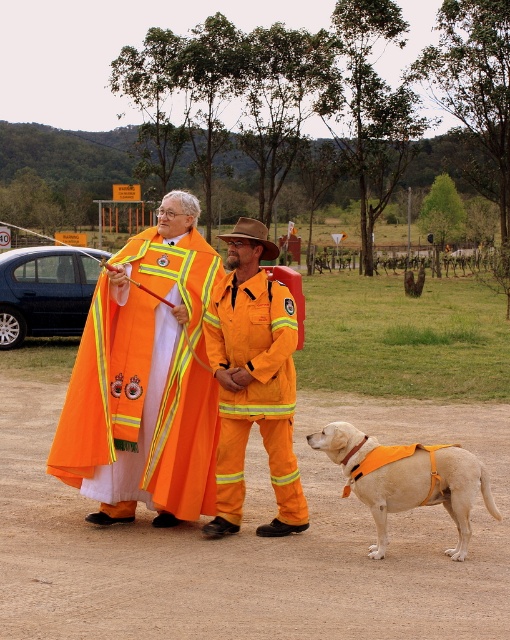
Question: Estimate the real-world distances between objects in this image. Which object is closer to the light brown fabric dog at lower right?

Choices:
 (A) high visibility fabric coat at center
 (B) dirt field at lower center
 (C) orange fireproof suit at center

Answer: (C)

Question: Which of the following is the closest to the observer?

Choices:
 (A) orange fireproof suit at center
 (B) dirt field at lower center
 (C) high visibility fabric coat at center
 (D) light brown fabric dog at lower right

Answer: (B)

Question: Can you confirm if high visibility fabric coat at center is positioned below orange fireproof suit at center?

Choices:
 (A) yes
 (B) no

Answer: (B)

Question: Does high visibility fabric coat at center have a smaller size compared to light brown fabric dog at lower right?

Choices:
 (A) no
 (B) yes

Answer: (B)

Question: Which object appears closest to the camera in this image?

Choices:
 (A) dirt field at lower center
 (B) light brown fabric dog at lower right
 (C) high visibility fabric coat at center
 (D) orange fireproof suit at center

Answer: (A)

Question: In this image, where is dirt field at lower center located relative to high visibility fabric coat at center?

Choices:
 (A) left
 (B) right

Answer: (A)